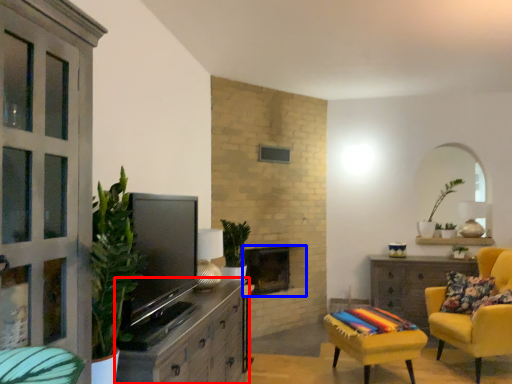
Question: Which point is further to the camera, cabinetry (highlighted by a red box) or fireplace (highlighted by a blue box)?

Choices:
 (A) cabinetry
 (B) fireplace

Answer: (B)